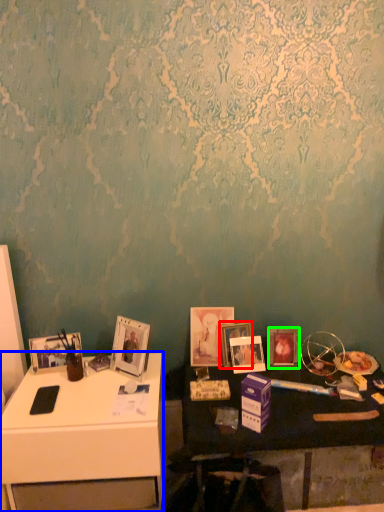
Question: Estimate the real-world distances between objects in this image. Which object is farther from picture frame (highlighted by a red box), desk (highlighted by a blue box) or picture frame (highlighted by a green box)?

Choices:
 (A) desk
 (B) picture frame

Answer: (A)